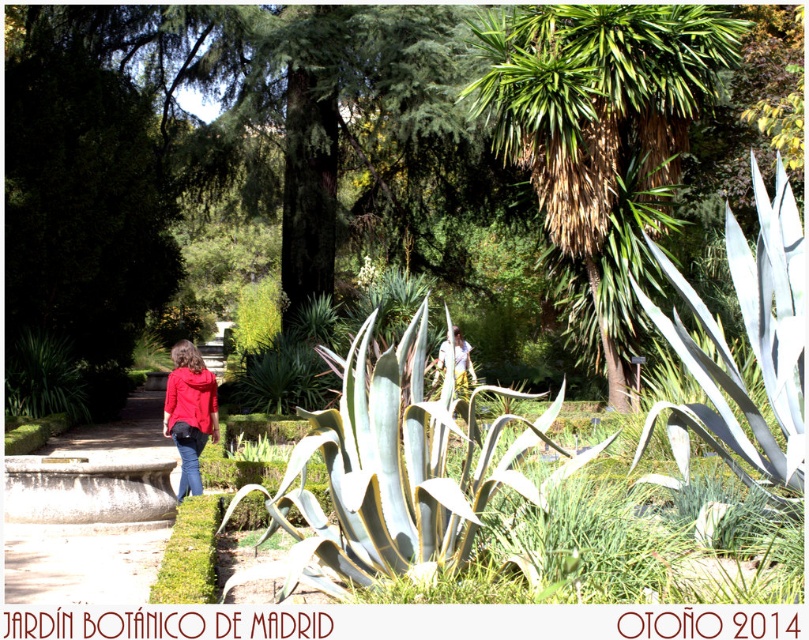
Question: In this image, where is denim jeans at lower left located relative to light brown hair at center?

Choices:
 (A) above
 (B) below

Answer: (B)

Question: Is matte red hoodie at center to the left of light brown hair at center from the viewer's perspective?

Choices:
 (A) no
 (B) yes

Answer: (B)

Question: Is matte red hoodie at center below matte red jacket at center?

Choices:
 (A) yes
 (B) no

Answer: (A)

Question: Which object is positioned farthest from the matte red jacket at center?

Choices:
 (A) denim jeans at lower left
 (B) matte red hoodie at center

Answer: (A)

Question: Which object is closer to the camera taking this photo?

Choices:
 (A) light brown hair at center
 (B) matte red jacket at center
 (C) matte red hoodie at center
 (D) denim jeans at lower left

Answer: (D)

Question: Considering the real-world distances, which object is closest to the denim jeans at lower left?

Choices:
 (A) matte red hoodie at center
 (B) matte red jacket at center
 (C) light brown hair at center

Answer: (A)